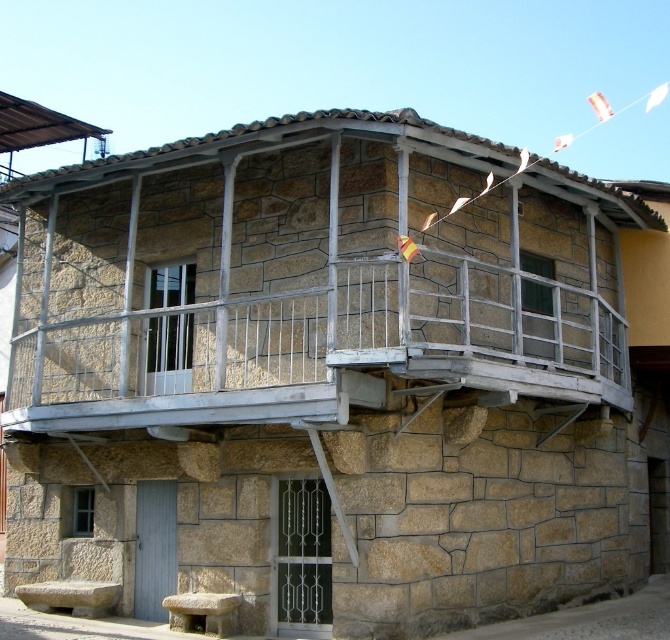
You are a visitor approaching the building and want to sit down. You see the white wooden balcony at upper center and the smooth stone bench at lower center. Which one is closer to the ground?

The smooth stone bench at lower center is closer to the ground because it is located at the lower center of the building, while the white wooden balcony at upper center is positioned above it.

You are an architect designing a new outdoor space. You have to choose between the white wooden balcony at upper center and the smooth stone bench at lower center for a project that requires a larger structure. Which one should you select?

You should select the white wooden balcony at upper center because it has a larger size compared to the smooth stone bench at lower center.